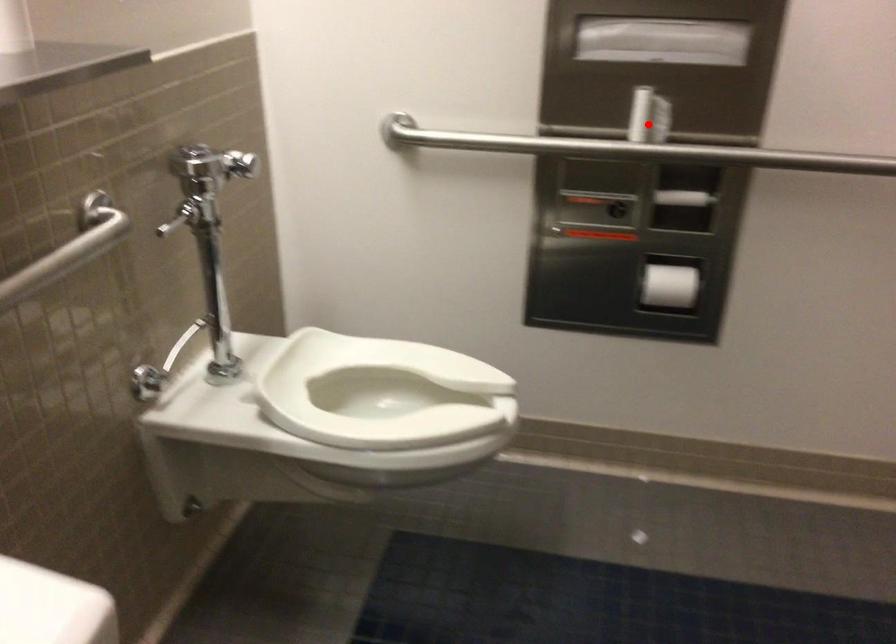
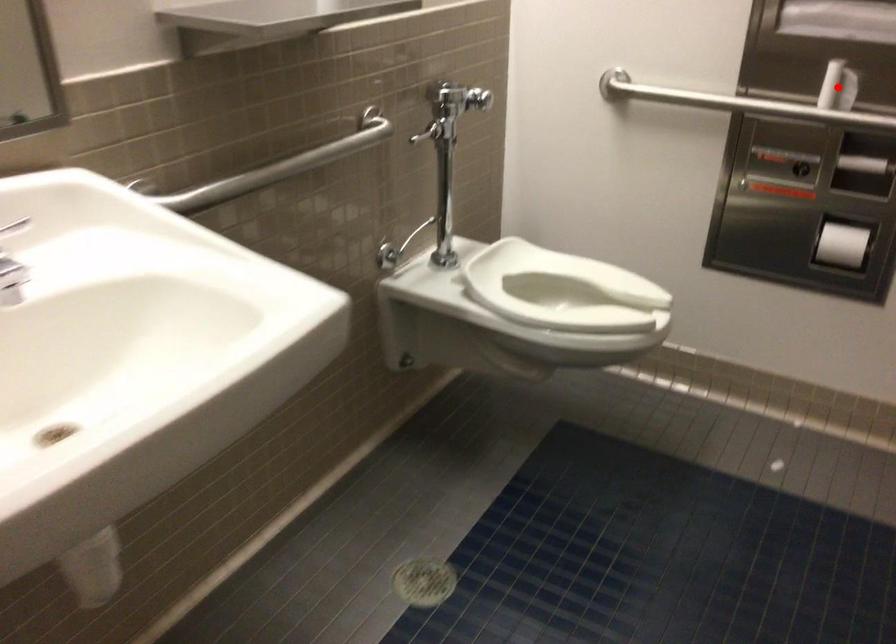
I am providing you with two images of the same scene from different viewpoints. A red point is marked on the first image and another point is marked on the second image. Is the marked point in image1 the same physical position as the marked point in image2?

Yes